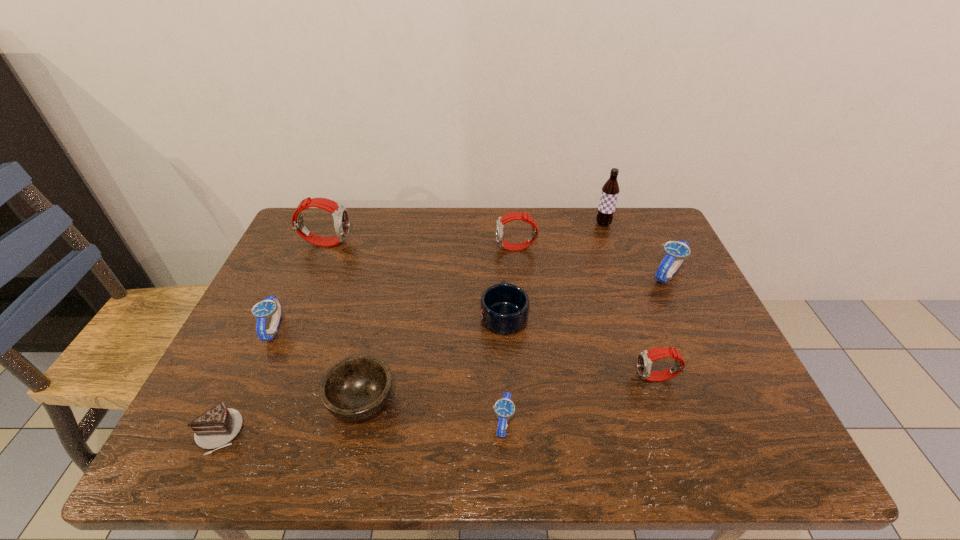
Identify the location of free space located on the face of the fifth shortest watch. (362, 248).

I want to click on vacant space located 0.370m on the face of the fifth shortest watch, so click(372, 248).

At what (x,y) coordinates should I click in order to perform the action: click on free space located on the face of the fifth shortest watch. Please return your answer as a coordinate pair (x, y). The height and width of the screenshot is (540, 960). Looking at the image, I should click on (369, 248).

Locate an element on the screen. blank area located 0.170m on the back of the biggest blue watch is located at coordinates (645, 226).

Where is `vacant space located on the face of the fifth watch from left to right`? vacant space located on the face of the fifth watch from left to right is located at coordinates (555, 378).

Locate an element on the screen. Image resolution: width=960 pixels, height=540 pixels. vacant space located on the face of the fifth watch from left to right is located at coordinates (573, 378).

I want to click on vacant space situated on the face of the fifth watch from left to right, so click(x=582, y=378).

Identify the location of free spot located on the right of the second nearest blue watch. (392, 328).

Locate an element on the screen. This screenshot has height=540, width=960. free space located 0.260m with the handle on the side of the blue mug is located at coordinates (499, 237).

Identify the location of vacant space positioned 0.210m with the handle on the side of the blue mug. This screenshot has width=960, height=540. coord(500,247).